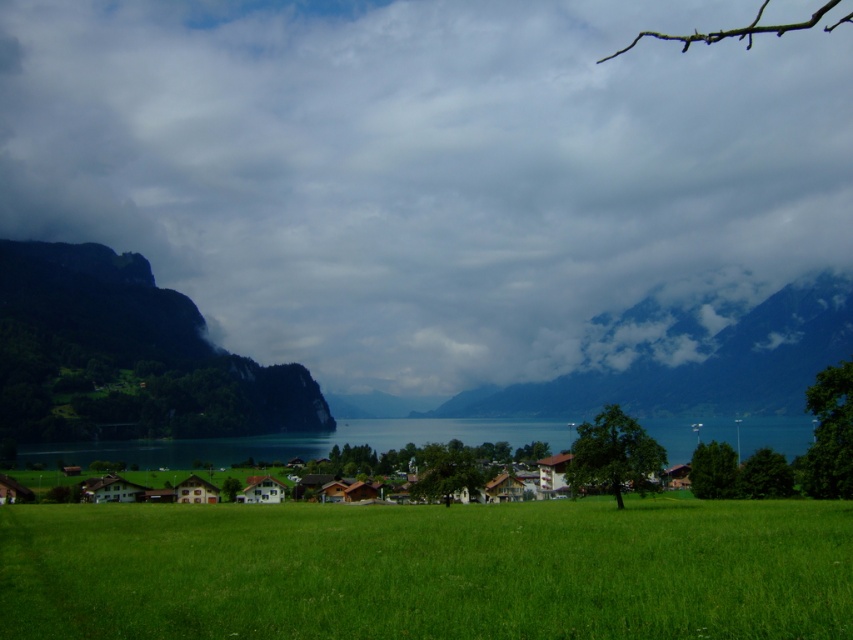
Identify the location of cloudy gray mountain at center. The height and width of the screenshot is (640, 853). (698, 365).

Is point (804, 314) farther from viewer compared to point (213, 486)?

Yes, point (804, 314) is behind point (213, 486).

Find the location of a particular element. Image resolution: width=853 pixels, height=640 pixels. cloudy gray mountain at center is located at coordinates (698, 365).

Between green grassy field at center and cloudy gray mountain at center, which one is positioned higher?

green grassy field at center

Identify the location of green grassy field at center. Image resolution: width=853 pixels, height=640 pixels. (428, 570).

Between cloudy sky at upper center and cloudy gray mountain at center, which one appears on the left side from the viewer's perspective?

From the viewer's perspective, cloudy sky at upper center appears more on the left side.

Who is shorter, cloudy sky at upper center or cloudy gray mountain at center?

cloudy gray mountain at center

Between point (200, 35) and point (482, 406), which one is positioned behind?

The point (200, 35) is behind.

This screenshot has height=640, width=853. Identify the location of cloudy sky at upper center. (432, 172).